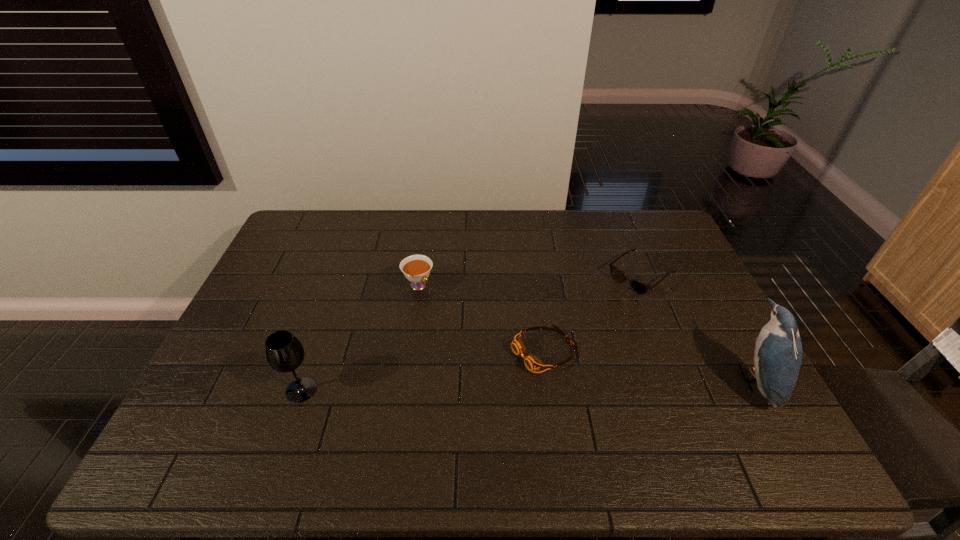
In order to click on vacant space situated 0.310m at the tip of the rightmost object's beak in this screenshot , I will do `click(616, 380)`.

Locate an element on the screen. The height and width of the screenshot is (540, 960). free space located at the tip of the rightmost object's beak is located at coordinates (718, 380).

What are the coordinates of `free location located on the front lenses of the fourth object from left to right` in the screenshot? It's located at (603, 306).

Where is `vacant space situated on the front lenses of the fourth object from left to right`? This screenshot has width=960, height=540. vacant space situated on the front lenses of the fourth object from left to right is located at coordinates (592, 314).

Find the location of a particular element. The image size is (960, 540). free spot located on the front lenses of the fourth object from left to right is located at coordinates (578, 326).

This screenshot has height=540, width=960. Find the location of `blank area located 0.390m on the side of the third shortest object with the handle`. blank area located 0.390m on the side of the third shortest object with the handle is located at coordinates (506, 381).

Where is `blank space located 0.250m on the side of the third shortest object with the handle`? blank space located 0.250m on the side of the third shortest object with the handle is located at coordinates (474, 346).

You are a GUI agent. You are given a task and a screenshot of the screen. Output one action in this format:
    pyautogui.click(x=<x>, y=<y>)
    Task: Click on the vacant space located 0.360m on the side of the third shortest object with the handle
    This screenshot has height=540, width=960.
    Given the screenshot: What is the action you would take?
    pyautogui.click(x=498, y=373)

Locate an element on the screen. free location located with the lenses facing forward on the goggles is located at coordinates (457, 394).

Find the location of `free region located 0.200m with the lenses facing forward on the goggles`. free region located 0.200m with the lenses facing forward on the goggles is located at coordinates (449, 397).